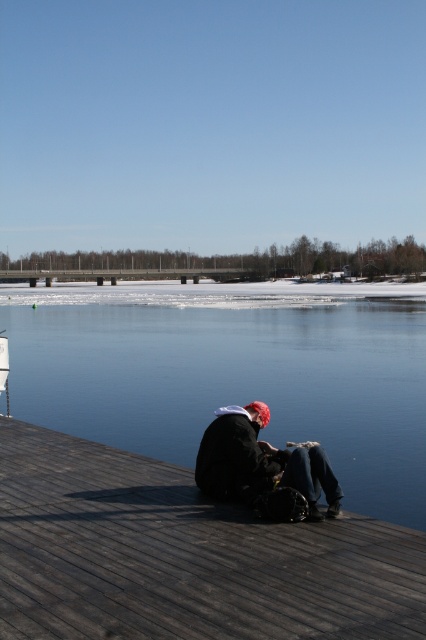
This screenshot has height=640, width=426. What do you see at coordinates (183, 556) in the screenshot? I see `dark wood dock at lower center` at bounding box center [183, 556].

Does point (81, 556) come behind point (199, 464)?

No, it is not.

You are a GUI agent. You are given a task and a screenshot of the screen. Output one action in this format:
    pyautogui.click(x=<x>, y=<y>)
    Task: Click on the dark wood dock at lower center
    The width and height of the screenshot is (426, 640).
    Given the screenshot: What is the action you would take?
    pyautogui.click(x=183, y=556)

Between transparent ice at lower center and dark wood dock at lower center, which one is positioned higher?

transparent ice at lower center

Who is more distant from viewer, (368, 444) or (354, 608)?

The point (368, 444) is behind.

Is point (0, 401) less distant than point (242, 582)?

That is False.

Identify the location of transparent ice at lower center. (232, 372).

This screenshot has height=640, width=426. What do you see at coordinates (232, 372) in the screenshot? I see `transparent ice at lower center` at bounding box center [232, 372].

Who is more forward, (98, 372) or (337, 502)?

Point (337, 502) is in front.

Locate an element on the screen. This screenshot has height=640, width=426. transparent ice at lower center is located at coordinates (232, 372).